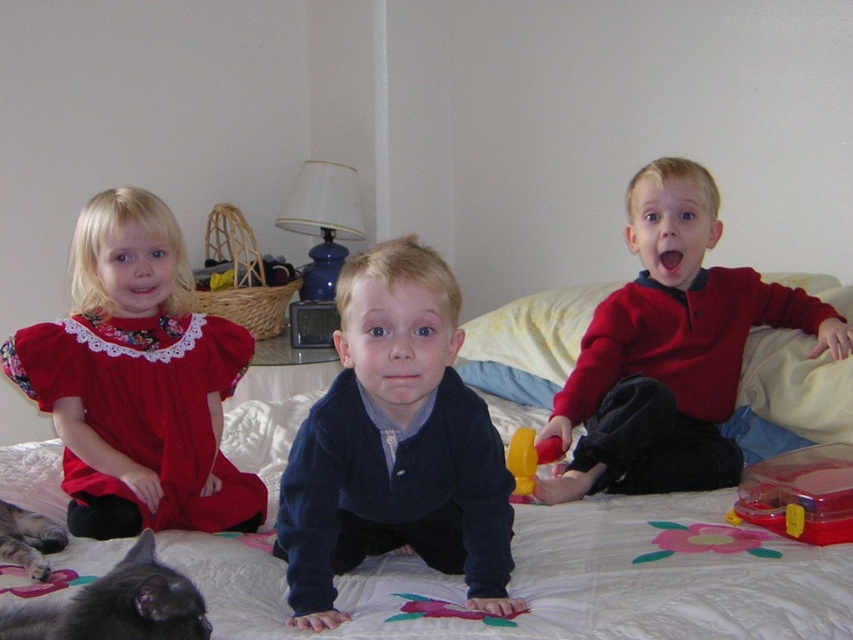
Is white quilted bed at center thinner than red matte sweater at center?

No.

Is point (779, 400) in front of point (630, 364)?

Yes.

Find the location of a particular element. The image size is (853, 640). white quilted bed at center is located at coordinates pos(563,579).

Between white quilted bed at center and rubber yellow toy at center, which one appears on the left side from the viewer's perspective?

white quilted bed at center

Is white quilted bed at center above rubber yellow toy at center?

Actually, white quilted bed at center is below rubber yellow toy at center.

Is point (683, 497) positioned after point (517, 432)?

No, it is in front of (517, 432).

The width and height of the screenshot is (853, 640). Identify the location of white quilted bed at center. (563, 579).

Who is higher up, red matte sweater at center or rubber yellow toy at center?

red matte sweater at center is above.

Which is in front, point (544, 426) or point (520, 493)?

Positioned in front is point (520, 493).

What are the coordinates of `red matte sweater at center` in the screenshot? It's located at (670, 349).